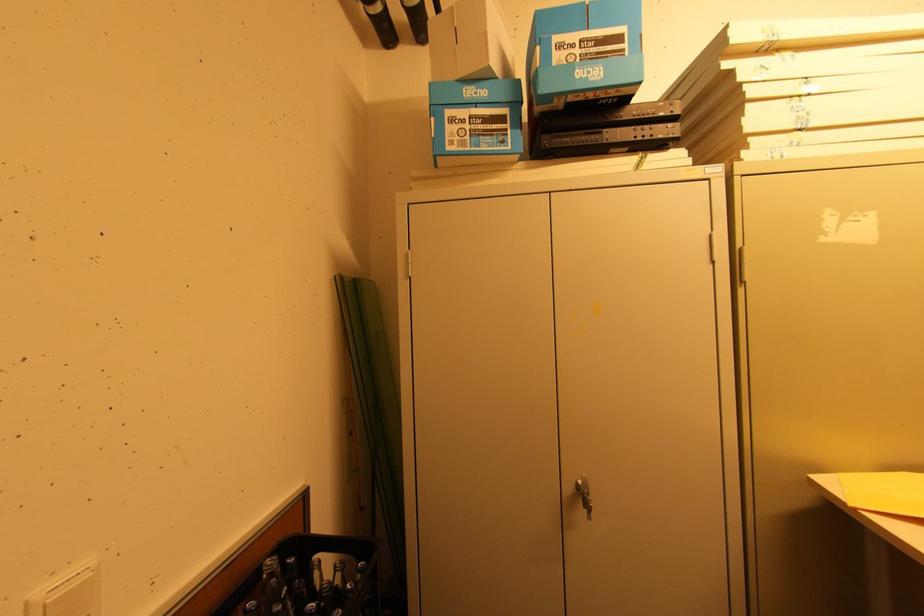
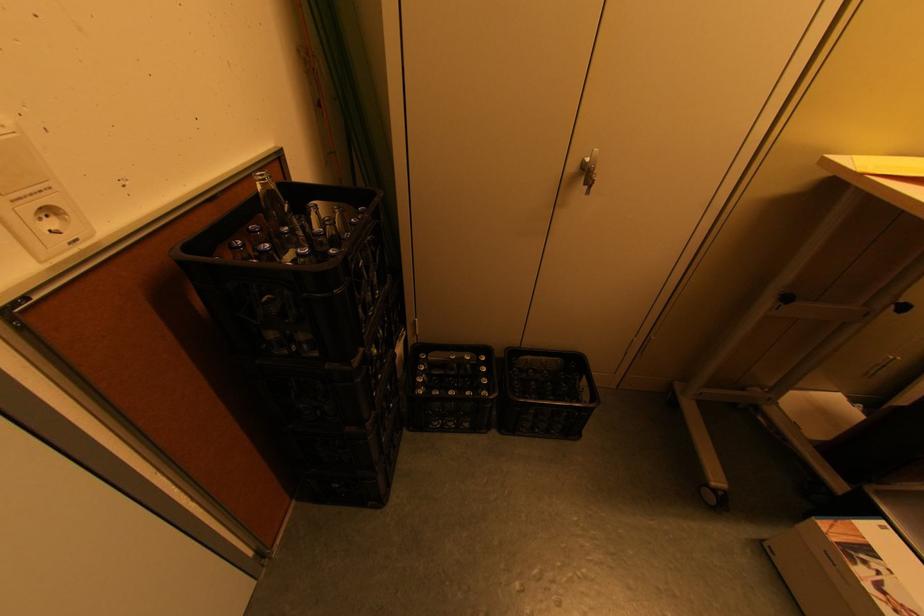
Where in the second image is the point corresponding to (x=580, y=484) from the first image?

(587, 161)